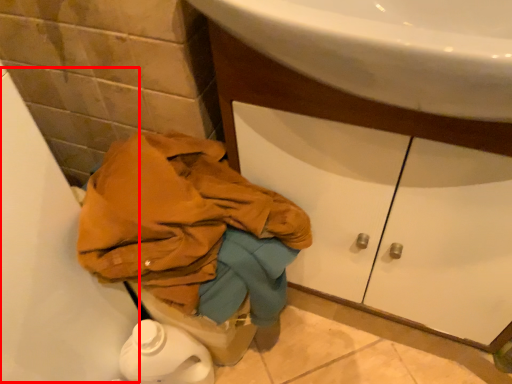
Question: From the image's perspective, where is bath (annotated by the red box) located in relation to drawer in the image?

Choices:
 (A) above
 (B) below

Answer: (B)